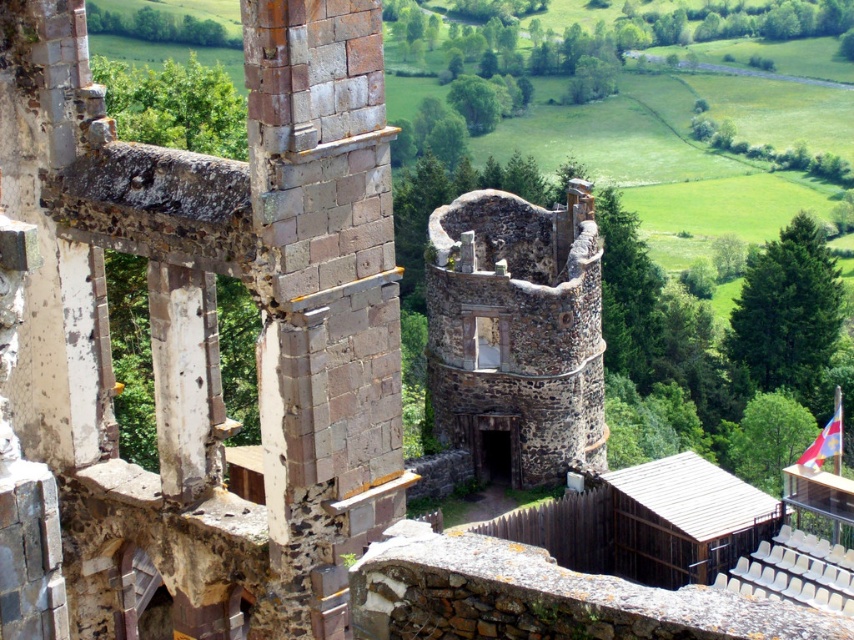
Does rusty stone tower at center have a greater height compared to rustic stone tower at center?

Indeed, rusty stone tower at center has a greater height compared to rustic stone tower at center.

Does rusty stone tower at center have a lesser height compared to rustic stone tower at center?

No, rusty stone tower at center is not shorter than rustic stone tower at center.

Measure the distance between point (338, 468) and camera.

Point (338, 468) is 133.13 feet from camera.

I want to click on rusty stone tower at center, so click(x=212, y=323).